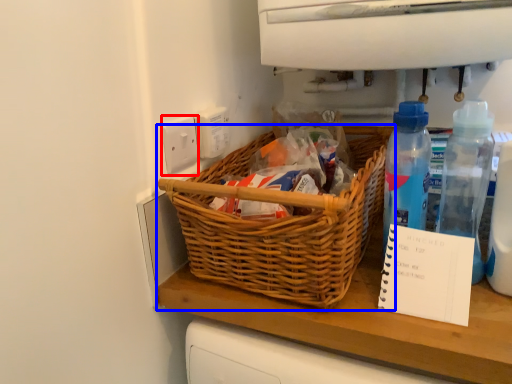
Question: Among these objects, which one is nearest to the camera, electric outlet (highlighted by a red box) or picnic basket (highlighted by a blue box)?

Choices:
 (A) electric outlet
 (B) picnic basket

Answer: (B)